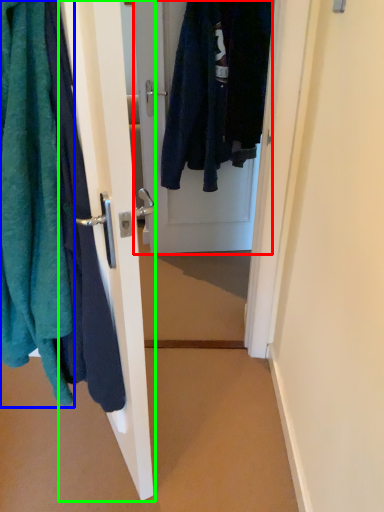
Question: Which is nearer to the door (highlighted by a red box)? towel (highlighted by a blue box) or door (highlighted by a green box).

Choices:
 (A) towel
 (B) door

Answer: (B)